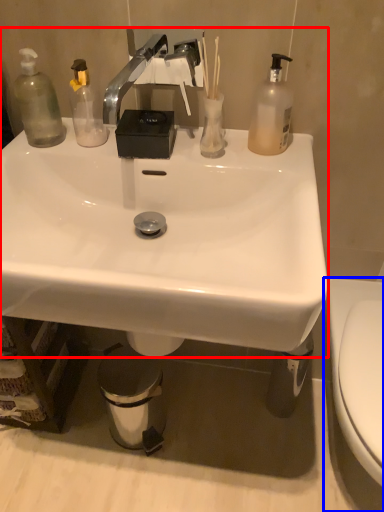
Question: Which object appears farthest to the camera in this image, sink (highlighted by a red box) or toilet (highlighted by a blue box)?

Choices:
 (A) sink
 (B) toilet

Answer: (A)